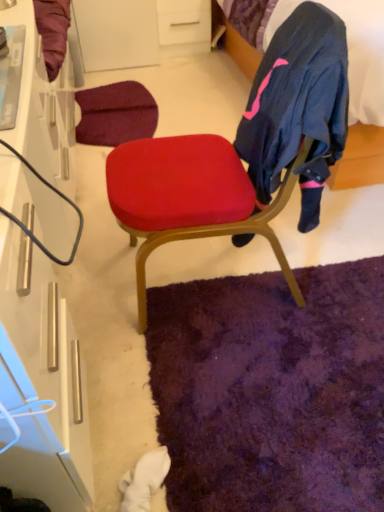
Question: Is velvet dark blue bed at upper right beside matte red cushion at center?

Choices:
 (A) yes
 (B) no

Answer: (B)

Question: Is velvet dark blue bed at upper right at the right side of matte red cushion at center?

Choices:
 (A) no
 (B) yes

Answer: (B)

Question: Is velvet dark blue bed at upper right behind matte red cushion at center?

Choices:
 (A) yes
 (B) no

Answer: (A)

Question: Does velvet dark blue bed at upper right lie in front of matte red cushion at center?

Choices:
 (A) no
 (B) yes

Answer: (A)

Question: Considering the relative sizes of velvet dark blue bed at upper right and matte red cushion at center in the image provided, is velvet dark blue bed at upper right bigger than matte red cushion at center?

Choices:
 (A) no
 (B) yes

Answer: (B)

Question: From a real-world perspective, is white matte drawer at upper center physically located above or below matte red cushion at center?

Choices:
 (A) below
 (B) above

Answer: (A)

Question: Considering their positions, is white matte drawer at upper center located in front of or behind matte red cushion at center?

Choices:
 (A) behind
 (B) front

Answer: (A)

Question: Is white matte drawer at upper center to the left or to the right of matte red cushion at center in the image?

Choices:
 (A) left
 (B) right

Answer: (A)

Question: Does point (178, 42) appear closer or farther from the camera than point (236, 221)?

Choices:
 (A) farther
 (B) closer

Answer: (A)

Question: Which is correct: matte red cushion at center is inside white glossy cabinet at left, or outside of it?

Choices:
 (A) outside
 (B) inside

Answer: (A)

Question: From a real-world perspective, is matte red cushion at center physically located above or below white glossy cabinet at left?

Choices:
 (A) above
 (B) below

Answer: (A)

Question: From the image's perspective, is matte red cushion at center located above or below white glossy cabinet at left?

Choices:
 (A) above
 (B) below

Answer: (A)

Question: Considering their positions, is matte red cushion at center located in front of or behind white glossy cabinet at left?

Choices:
 (A) front
 (B) behind

Answer: (B)

Question: From a real-world perspective, relative to velvet dark blue bed at upper right, is matte red cushion at center vertically above or below?

Choices:
 (A) above
 (B) below

Answer: (A)

Question: Is matte red cushion at center taller or shorter than velvet dark blue bed at upper right?

Choices:
 (A) tall
 (B) short

Answer: (A)